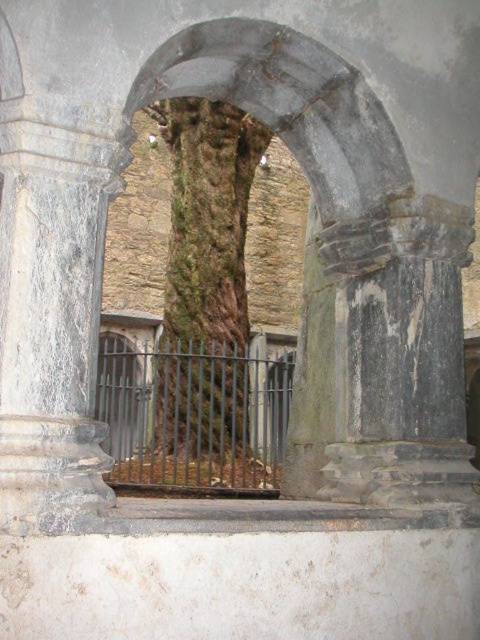
Where is `rough stone archway at center`? rough stone archway at center is located at coordinates (289, 106).